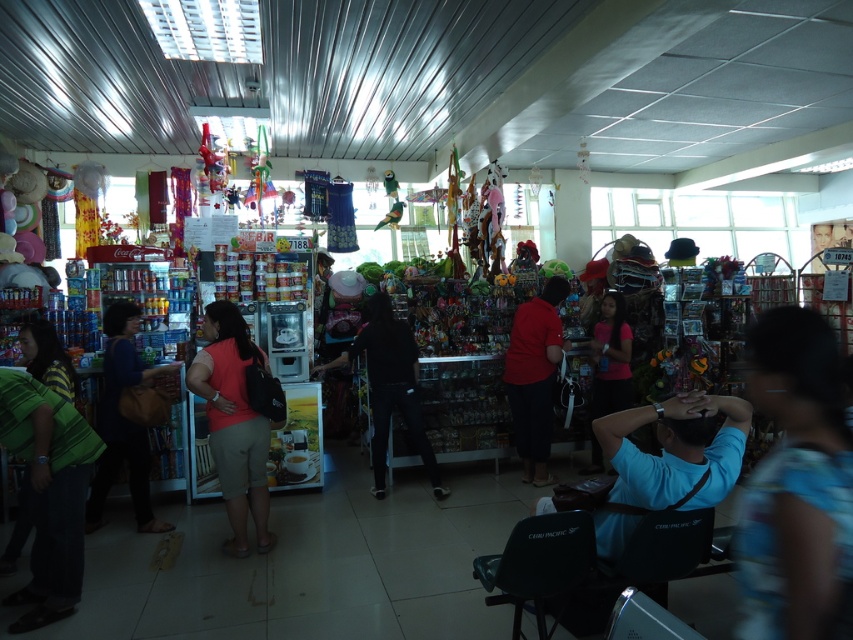
You are a customer in the store and want to pick up the pink matte shirt at center. Which direction should you move relative to the blue fabric shirt at right?

The blue fabric shirt at right is to the left of the pink matte shirt at center, so you should move to the right from the blue fabric shirt at right to reach the pink matte shirt at center.